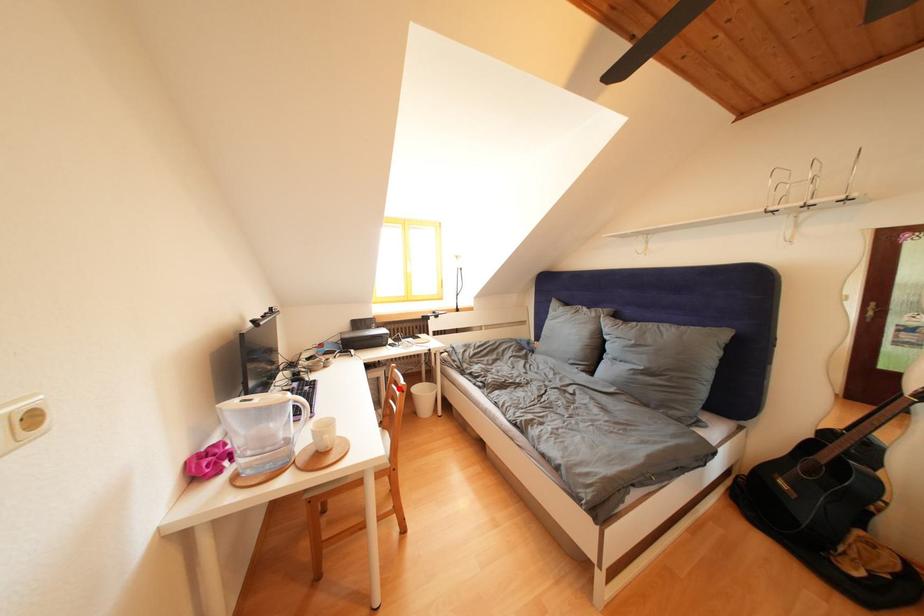
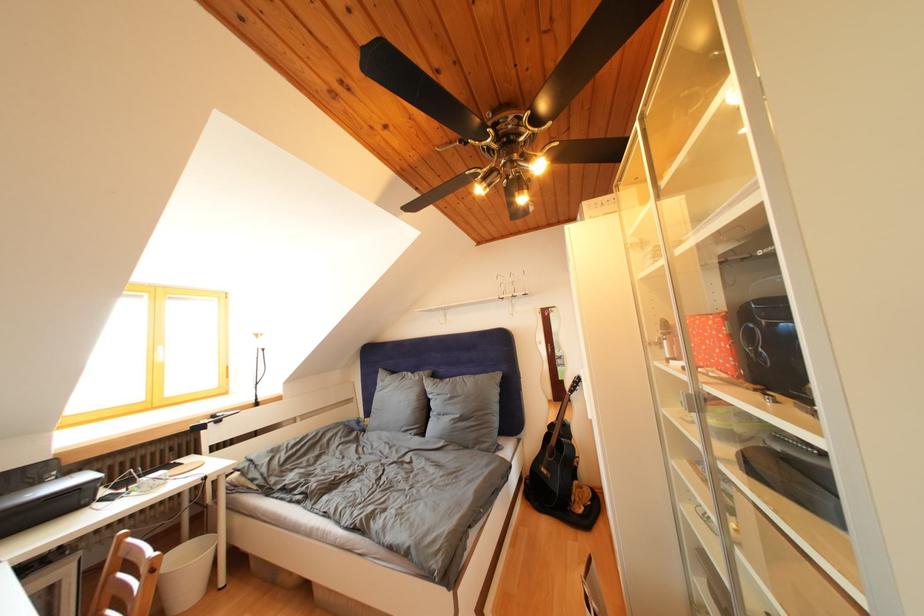
Question: I am providing you with two images of the same scene from different viewpoints. In image1, a red point is highlighted. Considering the same 3D point in image2, which of the following is correct?

Choices:
 (A) It is closer
 (B) It is farther

Answer: (B)